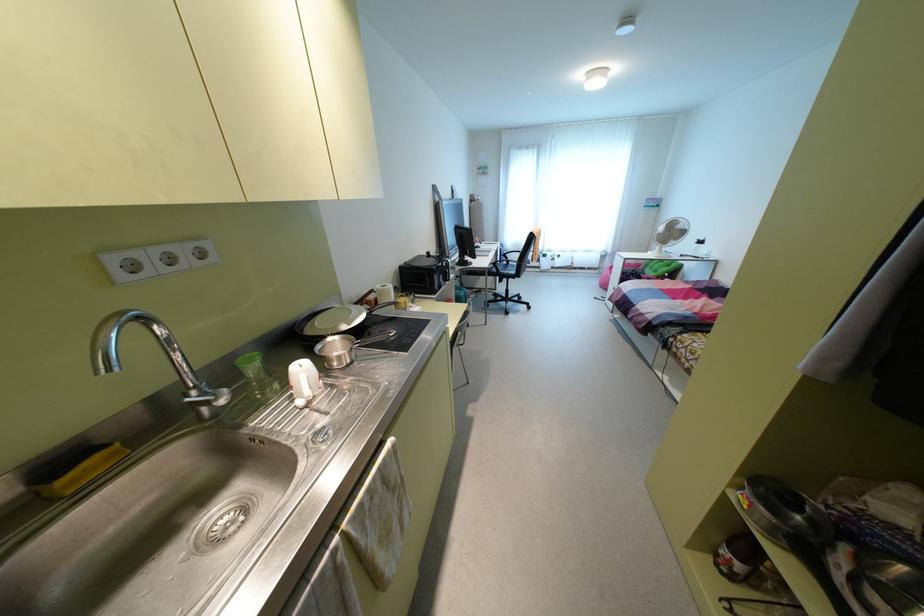
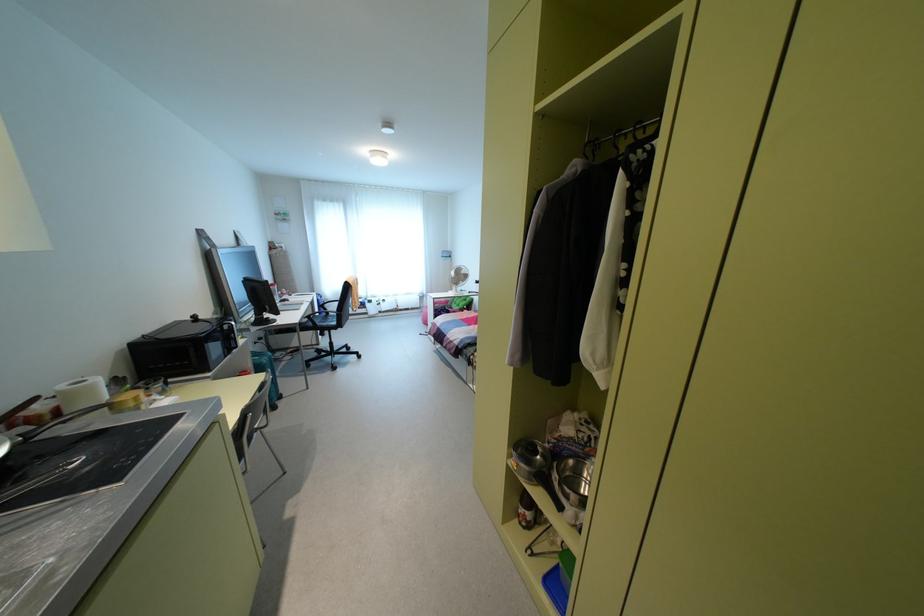
In the second image, find the point that corresponds to pixel 444 278 in the first image.

(229, 346)